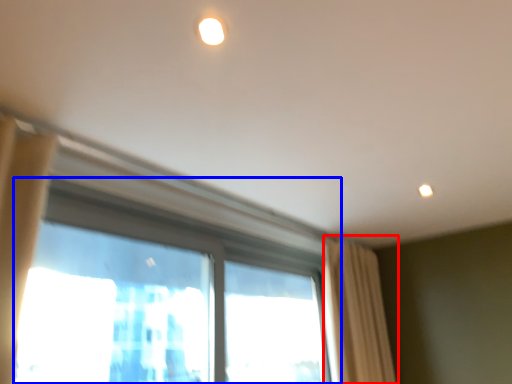
Question: Which object is further to the camera taking this photo, curtain (highlighted by a red box) or window (highlighted by a blue box)?

Choices:
 (A) curtain
 (B) window

Answer: (A)